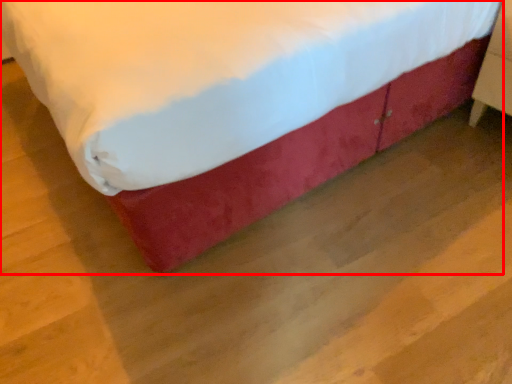
Question: From the image's perspective, considering the relative positions of bed (annotated by the red box) and furniture in the image provided, where is bed (annotated by the red box) located with respect to the staircase?

Choices:
 (A) above
 (B) below

Answer: (A)